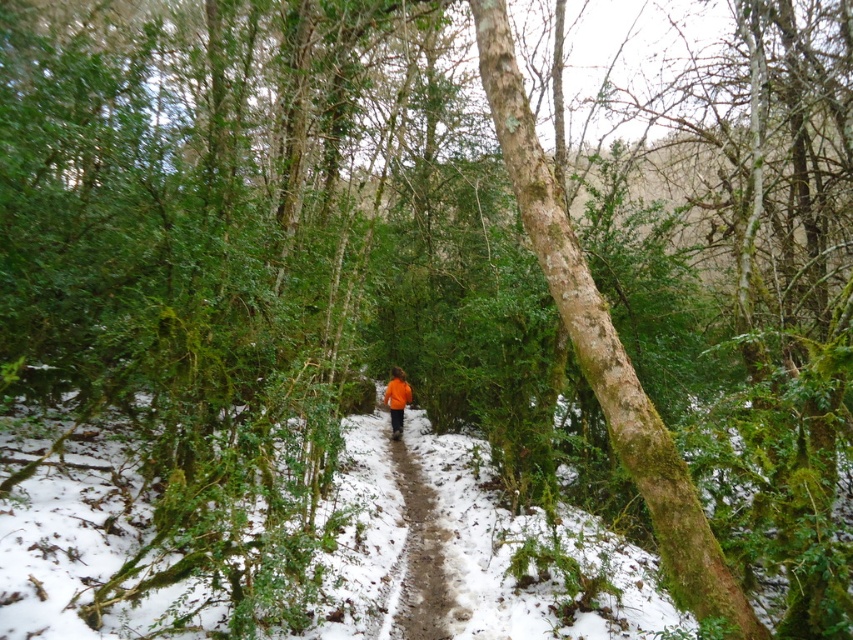
You are an explorer in the winter forest and need to decide whether to take shelter under the green mossy bark tree at center or use the orange fabric at center. Which option provides more coverage area?

The green mossy bark tree at center has a larger size compared to the orange fabric at center, so it provides a larger coverage area for shelter.

You are standing at the edge of the forest and see the green mossy bark tree at center. If you want to walk directly towards it along the path, which direction should you face?

Since the green mossy bark tree at center is located at point [605,348], you should face towards the center of the frame to walk directly towards it along the path.

Based on the photo, you are an outdoor enthusiast planning a winter hike and see the orange fabric at center and the orange fabric jacket at center in the image. Which item appears narrower when viewed from your perspective?

The orange fabric at center appears narrower than the orange fabric jacket at center because it has a lesser width compared to the jacket.